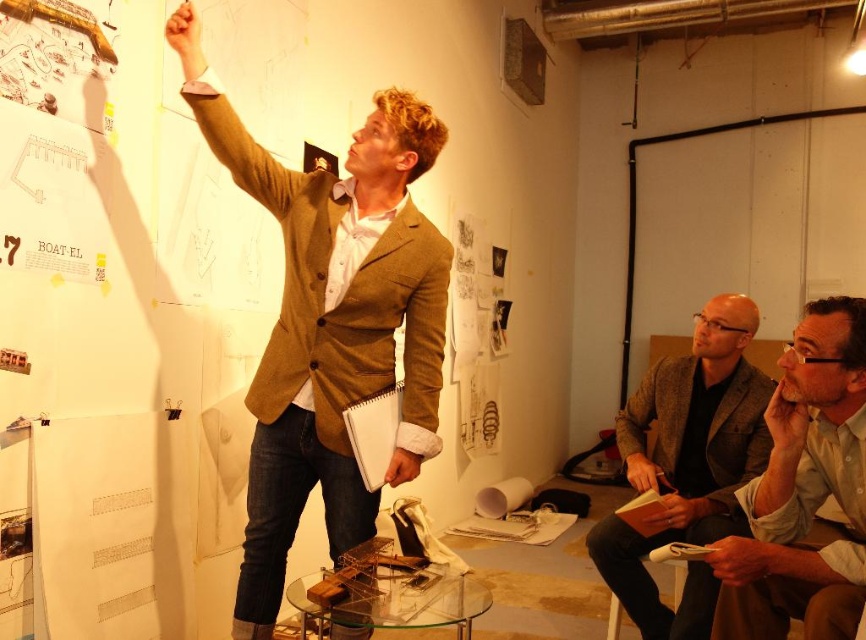
Does light brown leather jacket at lower right have a smaller size compared to white plastic stool at lower right?

Actually, light brown leather jacket at lower right might be larger than white plastic stool at lower right.

In the scene shown: Can you confirm if light brown leather jacket at lower right is taller than white plastic stool at lower right?

Indeed, light brown leather jacket at lower right has a greater height compared to white plastic stool at lower right.

Who is more forward, (768, 556) or (612, 595)?

Point (768, 556) is more forward.

Locate an element on the screen. This screenshot has height=640, width=866. light brown leather jacket at lower right is located at coordinates (803, 490).

Does light brown leather jacket at lower right appear on the right side of brown woolen blazer at lower right?

Correct, you'll find light brown leather jacket at lower right to the right of brown woolen blazer at lower right.

Does light brown leather jacket at lower right have a greater width compared to brown woolen blazer at lower right?

No.

Who is more distant from viewer, (848,541) or (711,461)?

Point (711,461)

Find the location of a particular element. The width and height of the screenshot is (866, 640). light brown leather jacket at lower right is located at coordinates (803, 490).

Is the position of brown textured blazer at upper center more distant than that of brown woolen blazer at lower right?

No, it is not.

Does brown textured blazer at upper center have a smaller size compared to brown woolen blazer at lower right?

Yes.

Is point (370, 516) closer to viewer compared to point (669, 524)?

Yes, point (370, 516) is in front of point (669, 524).

Where is `brown textured blazer at upper center`? The image size is (866, 640). brown textured blazer at upper center is located at coordinates pyautogui.click(x=330, y=321).